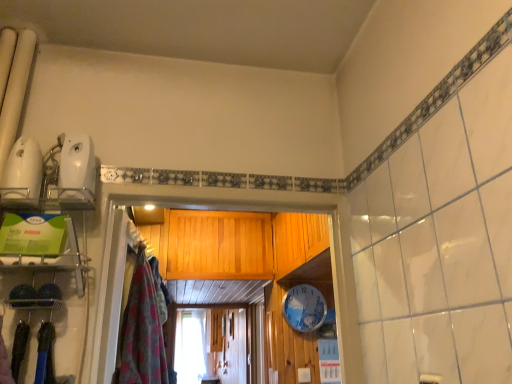
Question: Considering the positions of fluffy pink towel at left and white plastic clock at center in the image, is fluffy pink towel at left bigger or smaller than white plastic clock at center?

Choices:
 (A) big
 (B) small

Answer: (A)

Question: Is point (150, 321) closer or farther from the camera than point (297, 329)?

Choices:
 (A) farther
 (B) closer

Answer: (B)

Question: Based on their positions, is fluffy pink towel at left located to the left or right of white plastic clock at center?

Choices:
 (A) right
 (B) left

Answer: (B)

Question: Would you say white plastic clock at center is to the left or to the right of fluffy pink towel at left in the picture?

Choices:
 (A) right
 (B) left

Answer: (A)

Question: Looking at their shapes, would you say white plastic clock at center is wider or thinner than fluffy pink towel at left?

Choices:
 (A) wide
 (B) thin

Answer: (B)

Question: Which is correct: white plastic clock at center is inside fluffy pink towel at left, or outside of it?

Choices:
 (A) outside
 (B) inside

Answer: (A)

Question: From the image's perspective, is white plastic clock at center located above or below fluffy pink towel at left?

Choices:
 (A) above
 (B) below

Answer: (B)